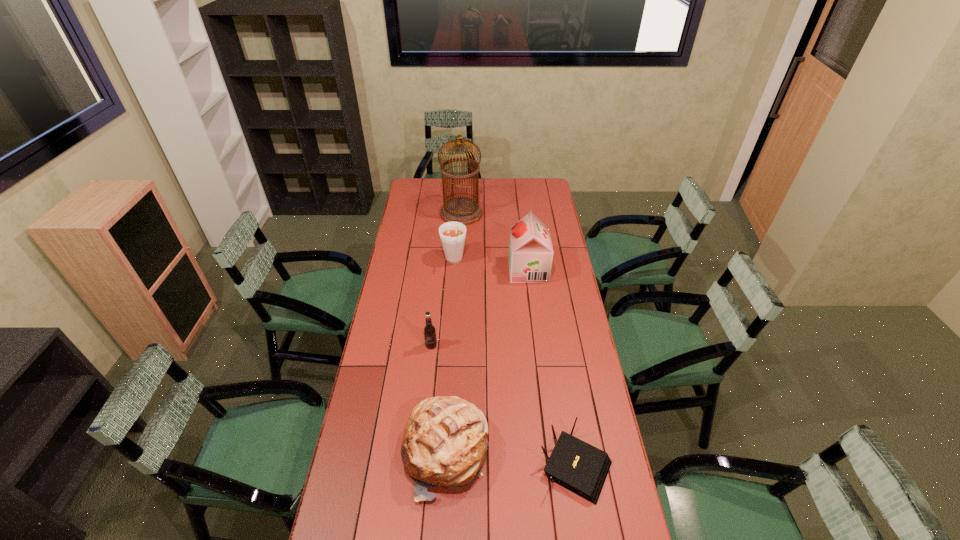
Find the location of a particular element. The width and height of the screenshot is (960, 540). free space located 0.370m with the cap open on the soya milk is located at coordinates (433, 270).

At what (x,y) coordinates should I click in order to perform the action: click on vacant space located with the cap open on the soya milk. Please return your answer as a coordinate pair (x, y). Image resolution: width=960 pixels, height=540 pixels. Looking at the image, I should click on (431, 270).

At what (x,y) coordinates should I click in order to perform the action: click on free space located with the cap open on the soya milk. Please return your answer as a coordinate pair (x, y). Looking at the image, I should click on (431, 270).

The image size is (960, 540). I want to click on blank space located 0.070m on the drink side of the third tallest object, so click(452, 284).

You are a GUI agent. You are given a task and a screenshot of the screen. Output one action in this format:
    pyautogui.click(x=<x>, y=<y>)
    Task: Click on the free location located on the label of the third nearest object
    This screenshot has height=540, width=960.
    Given the screenshot: What is the action you would take?
    pyautogui.click(x=421, y=436)

Locate an element on the screen. vacant space located on the back of the bread is located at coordinates (451, 357).

Find the location of `vacant space located 0.050m on the left of the router`. vacant space located 0.050m on the left of the router is located at coordinates pos(523,465).

Locate an element on the screen. soya milk at the right edge is located at coordinates (530, 257).

This screenshot has width=960, height=540. I want to click on router that is positioned at the right edge, so click(581, 468).

The width and height of the screenshot is (960, 540). In order to click on free region at the left edge of the desktop in this screenshot , I will do `click(350, 475)`.